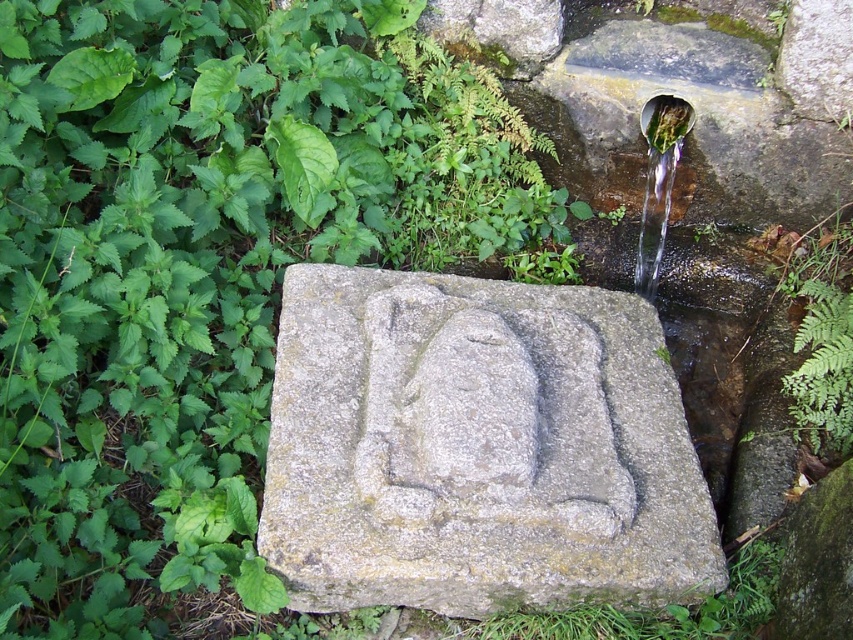
Question: Which point is farther to the camera?

Choices:
 (A) (782, 384)
 (B) (434, 602)
 (C) (650, 186)
 (D) (692, 632)

Answer: (C)

Question: Among these objects, which one is farthest from the camera?

Choices:
 (A) green grass at lower center
 (B) green leafy plant at lower right
 (C) gray stone carving at center

Answer: (B)

Question: In this image, where is gray stone carving at center located relative to green leafy plant at lower right?

Choices:
 (A) left
 (B) right

Answer: (A)

Question: Which is nearer to the green grass at lower center?

Choices:
 (A) green leafy plant at lower right
 (B) gray stone carving at center

Answer: (B)

Question: Does green grass at lower center appear on the left side of green metallic pipe at upper right?

Choices:
 (A) yes
 (B) no

Answer: (A)

Question: Is the position of gray stone carving at center more distant than that of green leafy plant at lower right?

Choices:
 (A) no
 (B) yes

Answer: (A)